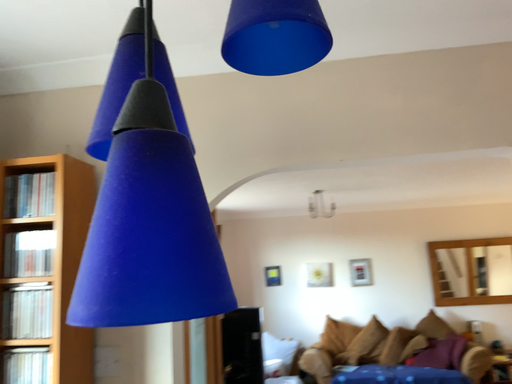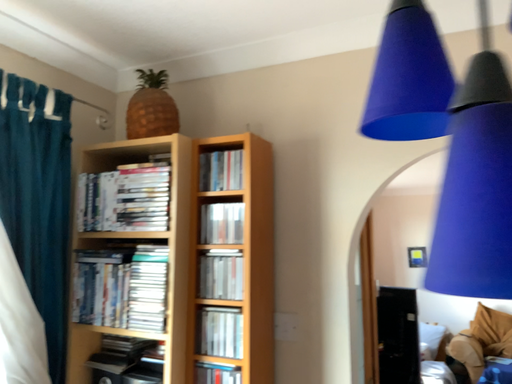
Question: Which way did the camera rotate in the video?

Choices:
 (A) rotated right
 (B) rotated left

Answer: (B)